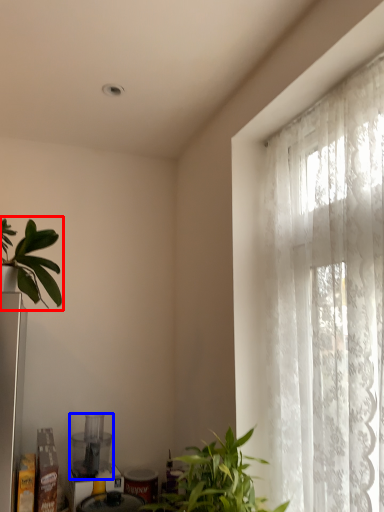
Question: Which object appears closest to the camera in this image, houseplant (highlighted by a red box) or appliance (highlighted by a blue box)?

Choices:
 (A) houseplant
 (B) appliance

Answer: (A)